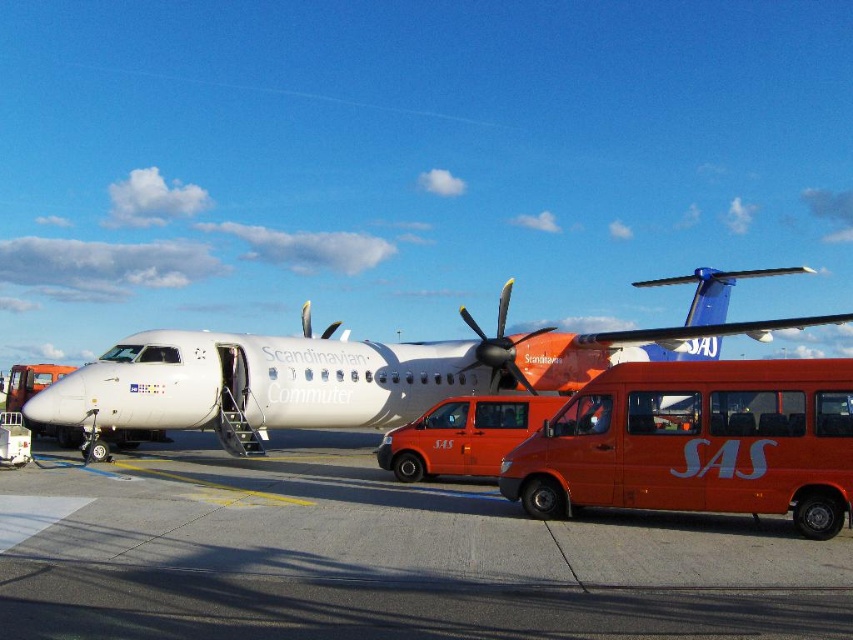
Question: Can you confirm if white matte airplane at center is positioned to the right of matte orange van at center?

Choices:
 (A) no
 (B) yes

Answer: (A)

Question: Which object appears closest to the camera in this image?

Choices:
 (A) yellow metallic propeller at center
 (B) orange matte van at center

Answer: (B)

Question: Which object is farther from the camera taking this photo?

Choices:
 (A) orange matte van at center
 (B) yellow metallic propeller at center

Answer: (B)

Question: In this image, where is white matte airplane at center located relative to yellow metallic propeller at center?

Choices:
 (A) below
 (B) above

Answer: (A)

Question: Is white matte airplane at center bigger than yellow metallic propeller at center?

Choices:
 (A) yes
 (B) no

Answer: (A)

Question: Based on their relative distances, which object is farther from the concrete at center?

Choices:
 (A) matte orange van at center
 (B) white matte airplane at center
 (C) yellow metallic propeller at center
 (D) orange matte van at center

Answer: (C)